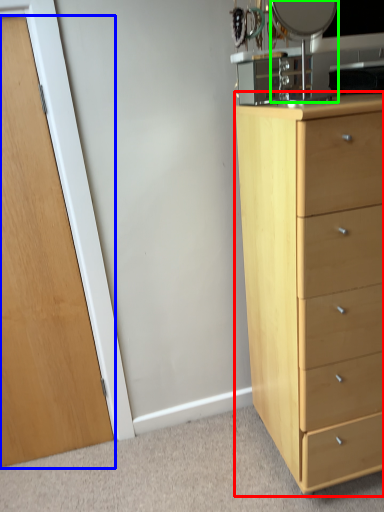
Question: Which object is the closest to the chest of drawers (highlighted by a red box)? Choose among these: door (highlighted by a blue box) or mirror (highlighted by a green box).

Choices:
 (A) door
 (B) mirror

Answer: (B)